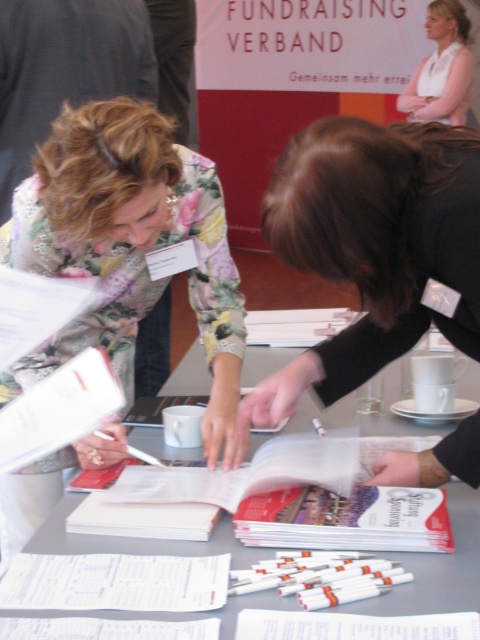
Question: Which point is farther to the camera?

Choices:
 (A) black matte book at center
 (B) white smooth shirt at upper right

Answer: (B)

Question: Which object is positioned closest to the black matte book at center?

Choices:
 (A) floral fabric dress at center
 (B) gray paper at center
 (C) white smooth shirt at upper right

Answer: (A)

Question: Estimate the real-world distances between objects in this image. Which object is farther from the black matte book at center?

Choices:
 (A) floral fabric dress at center
 (B) gray paper at center

Answer: (B)

Question: Does floral fabric dress at center have a smaller size compared to white smooth shirt at upper right?

Choices:
 (A) yes
 (B) no

Answer: (B)

Question: Does black matte book at center have a lesser width compared to white smooth shirt at upper right?

Choices:
 (A) no
 (B) yes

Answer: (B)

Question: Is floral fabric dress at center smaller than black matte book at center?

Choices:
 (A) no
 (B) yes

Answer: (A)